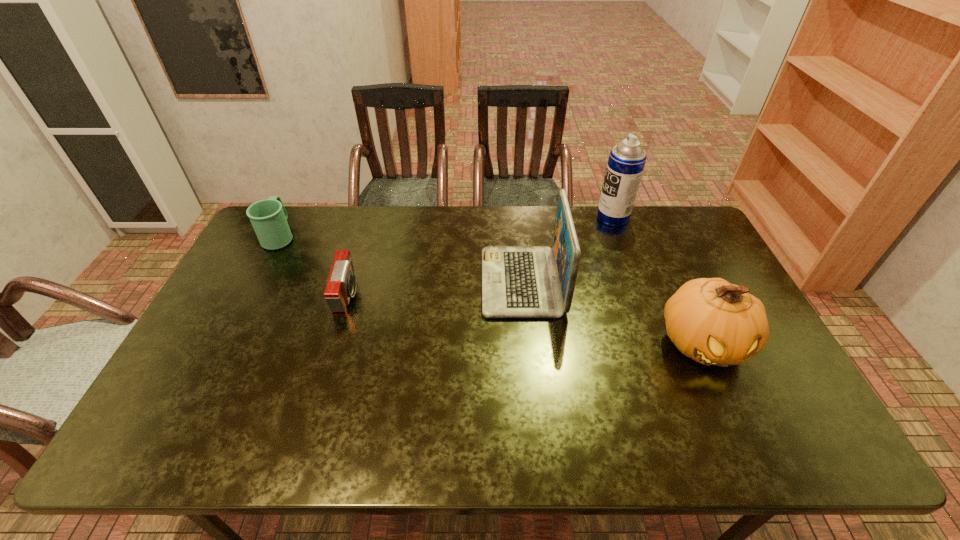
This screenshot has height=540, width=960. Identify the location of object present at the far left corner. (268, 217).

Identify the location of free space at the far edge of the desktop. (428, 223).

Where is `vacant position at the near edge of the desktop`? This screenshot has height=540, width=960. vacant position at the near edge of the desktop is located at coordinates (444, 453).

This screenshot has height=540, width=960. In the image, there is a desktop. Find the location of `vacant space at the left edge`. vacant space at the left edge is located at coordinates (230, 346).

In order to click on vacant space at the far left corner of the desktop in this screenshot , I will do tap(252, 248).

Locate an element on the screen. free space at the far right corner of the desktop is located at coordinates (646, 209).

At what (x,y) coordinates should I click in order to perform the action: click on free space at the near right corner. Please return your answer as a coordinate pair (x, y). The image size is (960, 540). Looking at the image, I should click on (776, 456).

This screenshot has width=960, height=540. Find the location of `empty space between the laptop computer and the pumpkin`. empty space between the laptop computer and the pumpkin is located at coordinates (612, 313).

Find the location of a particular element. This screenshot has width=960, height=540. free space between the third object from left to right and the leftmost object is located at coordinates click(x=401, y=259).

You are a GUI agent. You are given a task and a screenshot of the screen. Output one action in this format:
    pyautogui.click(x=<x>, y=<y>)
    Task: Click on the empty space between the third object from right to left and the leftmost object
    This screenshot has height=540, width=960.
    Given the screenshot: What is the action you would take?
    pyautogui.click(x=401, y=259)